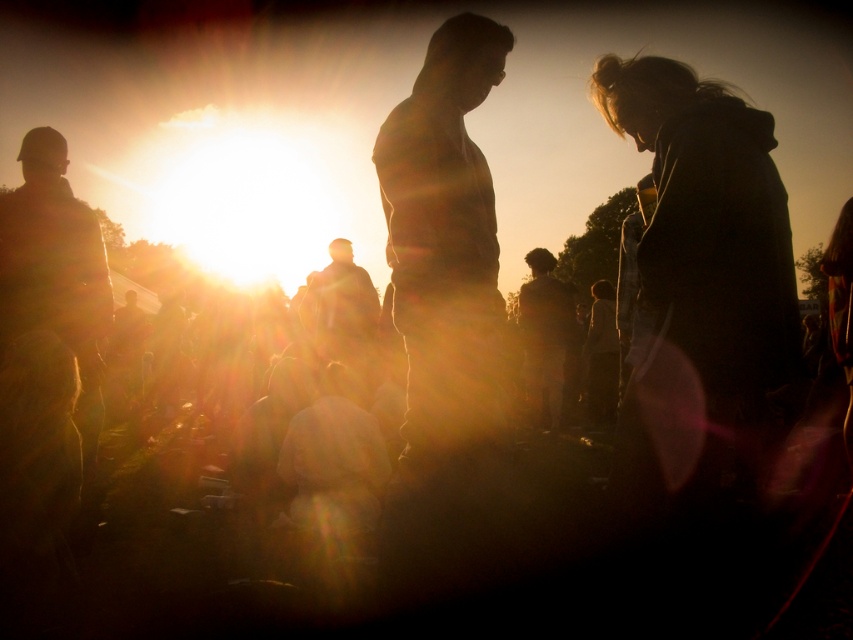
You are a photographer trying to capture a clear shot of the dark gray hoodie at right and the dark hair at center. Since the sun is low in the sky, you need to adjust your position to avoid glare. Which object should you move closer to the light source to ensure both are visible without glare?

The dark gray hoodie at right is positioned under dark hair at center. To avoid glare, you should move closer to the light source so that the dark hair at center is between the sun and the camera, casting a shadow over the dark gray hoodie at right, reducing glare on it.

In the scene shown: You are a photographer trying to capture a shot of the dark gray hoodie at right and the silhouette figure at center. Which object is positioned closer to your camera lens?

The dark gray hoodie at right is closer to the viewer than the silhouette figure at center, so it will appear closer to the camera lens in the photograph.

You are a photographer trying to capture the silhouette figure at center and dark hair at center in a single frame. Given their sizes in the image, which one would you need to adjust your camera focus on first to ensure both are in focus?

The silhouette figure at center occupies less space than dark hair at center, so you should focus on the silhouette figure at center first since it is smaller and requires precise focus to capture details.